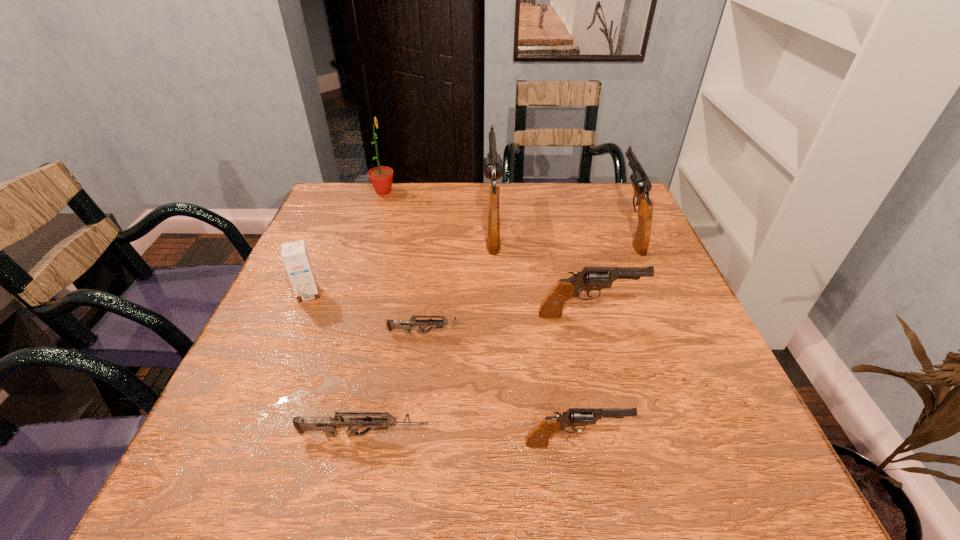
Identify the location of black gun that is the closest to the rightmost gun. The image size is (960, 540). (590, 278).

Where is `vacant region that satisfies the following two spatial constraints: 1. along the barrel of the sixth shortest object; 2. on the face of the sunflower`? vacant region that satisfies the following two spatial constraints: 1. along the barrel of the sixth shortest object; 2. on the face of the sunflower is located at coordinates (614, 192).

Identify the location of free spot that satisfies the following two spatial constraints: 1. on the face of the sunflower; 2. along the barrel of the tallest gun. (374, 219).